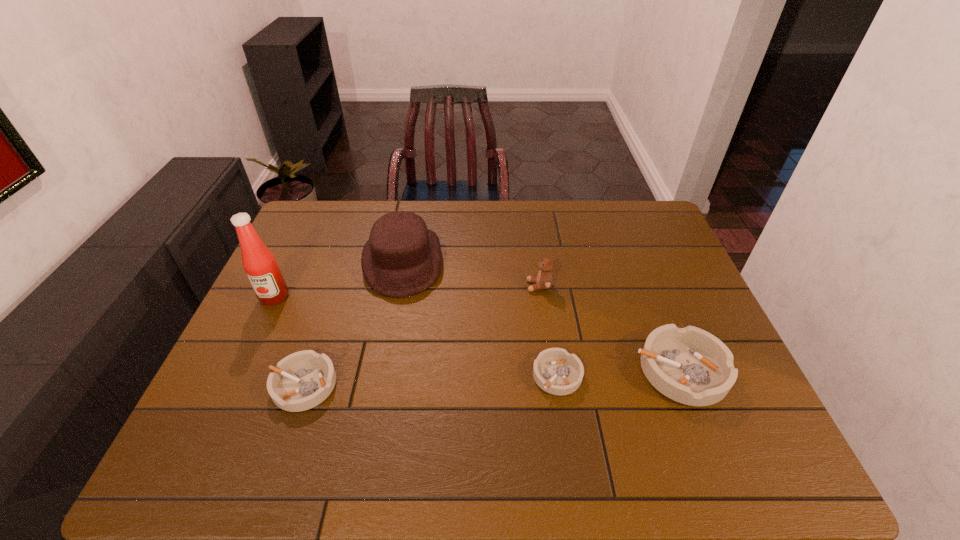
Where is `free spot between the hat and the leftmost object`? free spot between the hat and the leftmost object is located at coordinates (339, 279).

The image size is (960, 540). Identify the location of the closest object to the second shortest ashtray. (260, 265).

This screenshot has height=540, width=960. I want to click on object that is the closest to the fifth tallest object, so click(260, 265).

Locate which ashtray is the second closest to the shortest object. Please provide its 2D coordinates. Your answer should be formatted as a tuple, i.e. [(x, y)], where the tuple contains the x and y coordinates of a point satisfying the conditions above.

[(302, 380)]

Identify which ashtray is the second closest to the fourth tallest object. Please provide its 2D coordinates. Your answer should be formatted as a tuple, i.e. [(x, y)], where the tuple contains the x and y coordinates of a point satisfying the conditions above.

[(302, 380)]

Where is `free space that satisfies the following two spatial constraints: 1. on the front-facing side of the shortest object; 2. on the left side of the teddy bear`? This screenshot has height=540, width=960. free space that satisfies the following two spatial constraints: 1. on the front-facing side of the shortest object; 2. on the left side of the teddy bear is located at coordinates (552, 375).

Find the location of a particular element. This screenshot has height=540, width=960. free location that satisfies the following two spatial constraints: 1. on the back side of the leftmost ashtray; 2. on the left side of the shortest ashtray is located at coordinates (306, 375).

The width and height of the screenshot is (960, 540). I want to click on blank space that satisfies the following two spatial constraints: 1. on the front-facing side of the teddy bear; 2. on the back side of the third shortest object, so click(x=551, y=370).